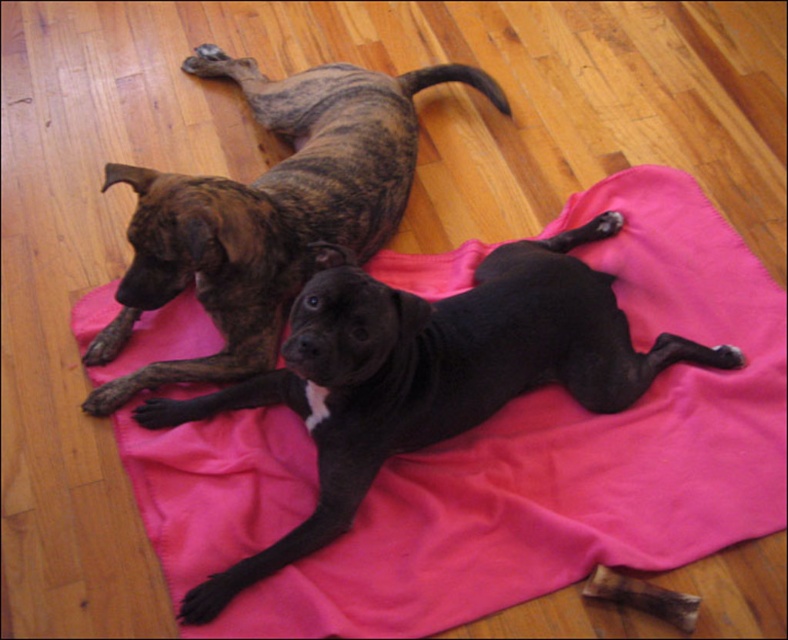
Between black smooth dog at center and brindle fur dog at upper left, which one has less height?

With less height is black smooth dog at center.

Does black smooth dog at center have a smaller size compared to brindle fur dog at upper left?

No.

From the picture: Who is more distant from viewer, (511, 355) or (287, 109)?

The point (287, 109) is behind.

Locate an element on the screen. Image resolution: width=788 pixels, height=640 pixels. black smooth dog at center is located at coordinates (428, 372).